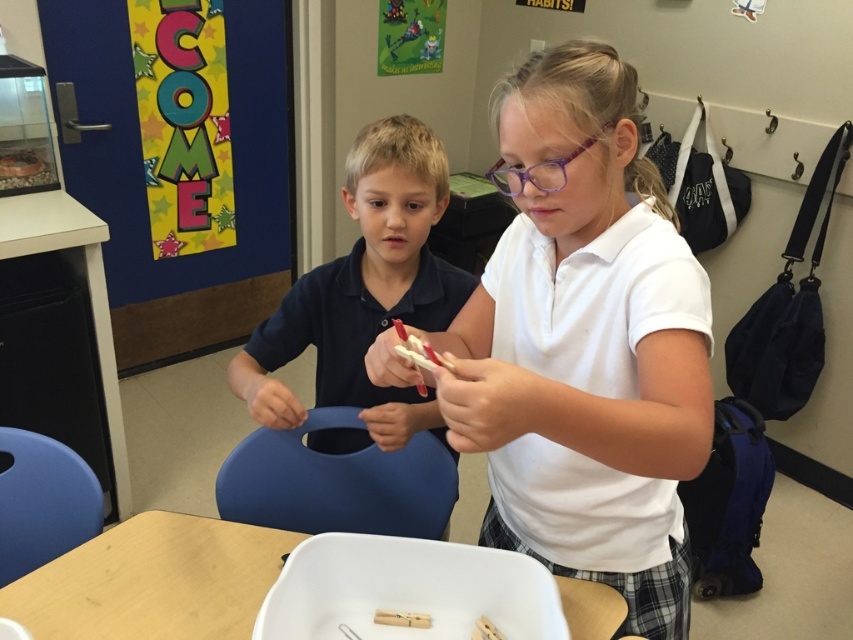
Which is more to the right, white matte shirt at center or wooden clothespin at center?

white matte shirt at center is more to the right.

Is white matte shirt at center bigger than wooden clothespin at center?

Yes.

Locate an element on the screen. The image size is (853, 640). white matte shirt at center is located at coordinates (584, 344).

From the picture: Can you confirm if white matte shirt at center is wider than matte blue shirt at center?

Correct, the width of white matte shirt at center exceeds that of matte blue shirt at center.

Does white matte shirt at center lie in front of matte blue shirt at center?

Yes, white matte shirt at center is in front of matte blue shirt at center.

Measure the distance between white matte shirt at center and camera.

white matte shirt at center and camera are 27.69 inches apart from each other.

At what (x,y) coordinates should I click in order to perform the action: click on white matte shirt at center. Please return your answer as a coordinate pair (x, y). The width and height of the screenshot is (853, 640). Looking at the image, I should click on (584, 344).

Which is above, wooden table at center or wooden clothespin at center?

wooden table at center is above.

Is point (166, 614) in front of point (380, 621)?

No, (166, 614) is behind (380, 621).

Which is in front, point (57, 634) or point (373, 620)?

Positioned in front is point (373, 620).

Identify the location of wooden table at center. (154, 580).